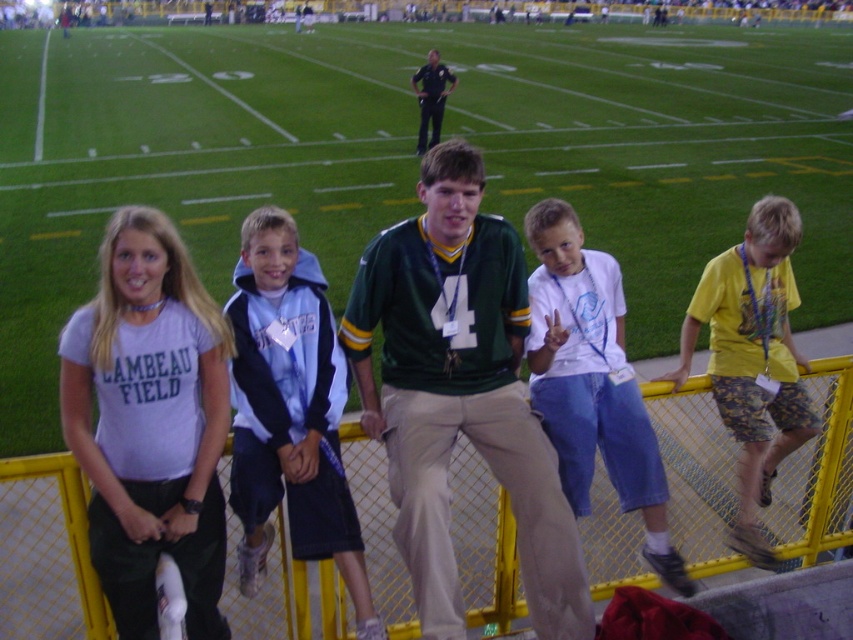
Does blue fleece jacket at center lie behind yellow cotton shirt at right?

No, it is not.

Does blue fleece jacket at center appear on the right side of yellow cotton shirt at right?

In fact, blue fleece jacket at center is to the left of yellow cotton shirt at right.

Is point (274, 224) farther from camera compared to point (720, 276)?

No, it is not.

Where is `blue fleece jacket at center`? The image size is (853, 640). blue fleece jacket at center is located at coordinates (289, 412).

Is green jersey at center positioned before light purple t-shirt at center?

Yes.

Between point (461, 272) and point (155, 506), which one is positioned behind?

Point (461, 272)

The image size is (853, 640). Identify the location of green jersey at center. (459, 394).

Between point (91, 636) and point (553, 237), which one is positioned behind?

The point (553, 237) is more distant.

What do you see at coordinates (45, 552) in the screenshot? The image size is (853, 640). I see `yellow metal fence at lower center` at bounding box center [45, 552].

Who is more forward, (717, 557) or (572, 412)?

Point (572, 412)

Where is `yellow metal fence at lower center`? This screenshot has height=640, width=853. yellow metal fence at lower center is located at coordinates (45, 552).